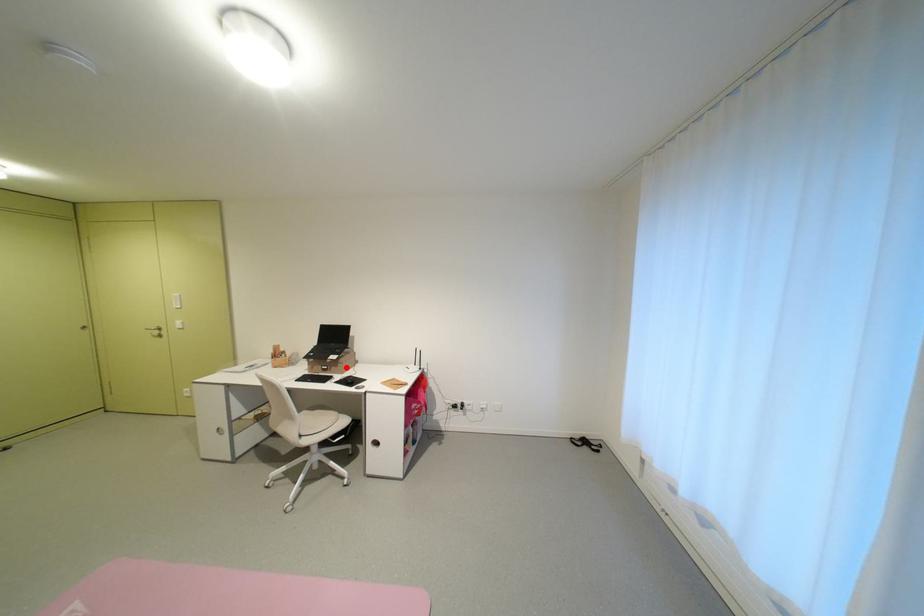
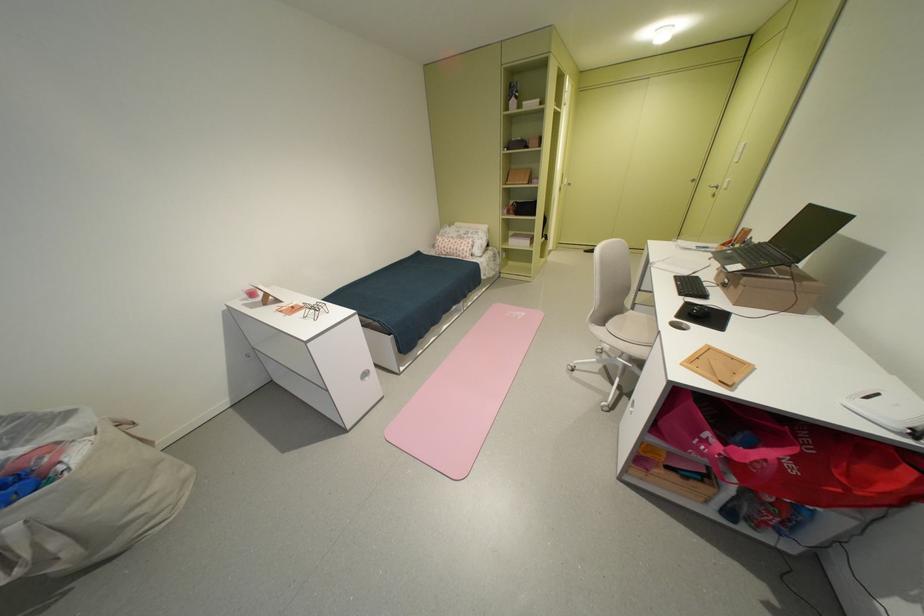
Locate, in the second image, the point that corresponds to the highlighted location in the first image.

(746, 288)